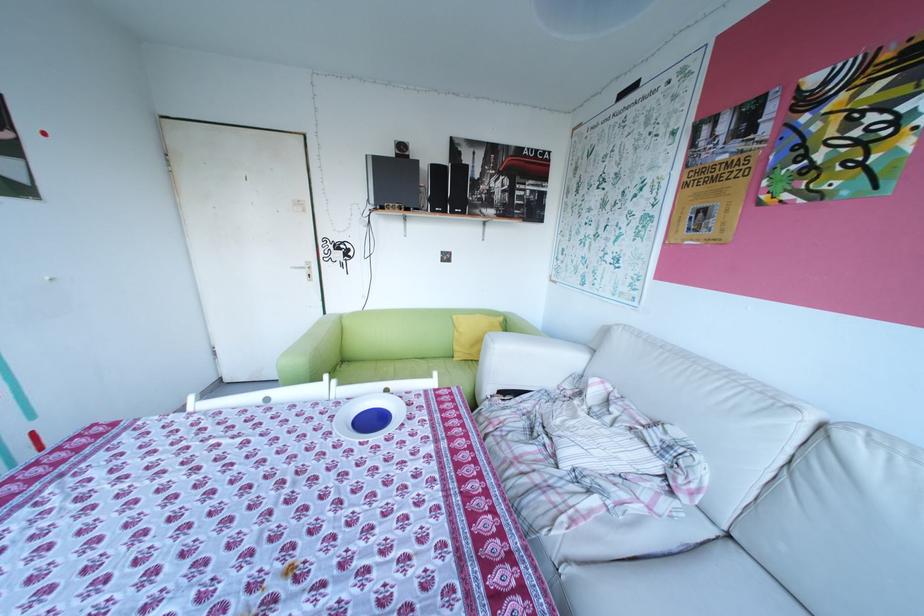
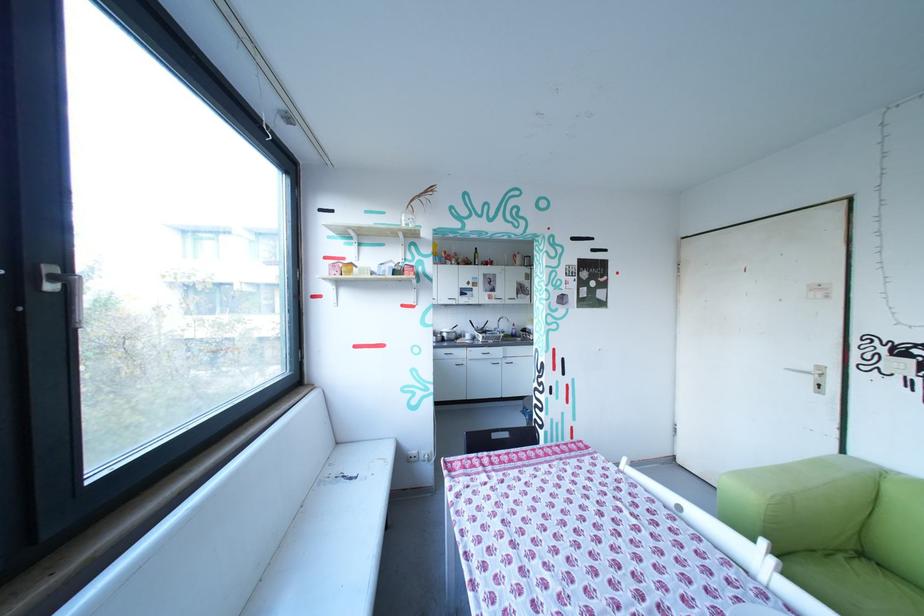
In the second image, find the point that corresponds to point 346,382 in the first image.

(785, 562)